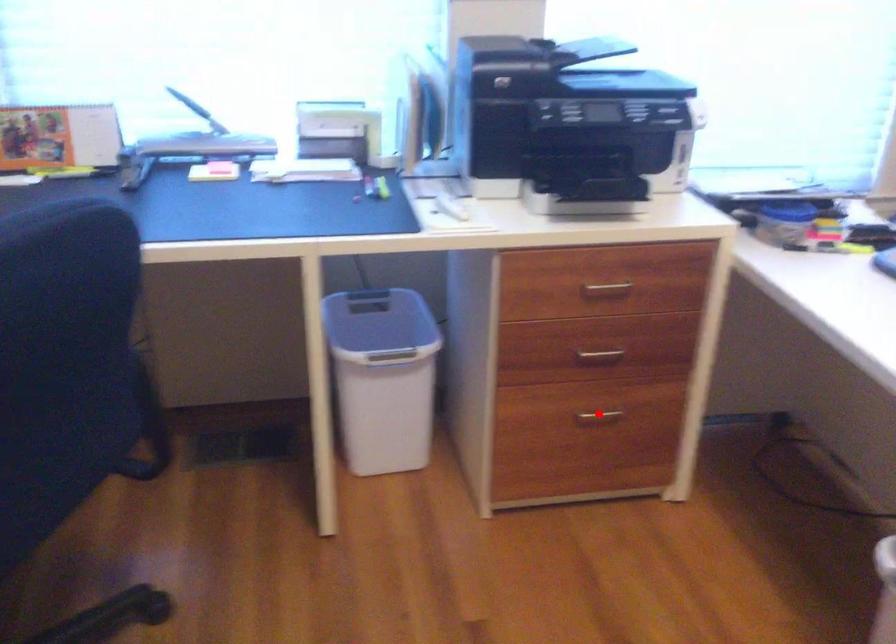
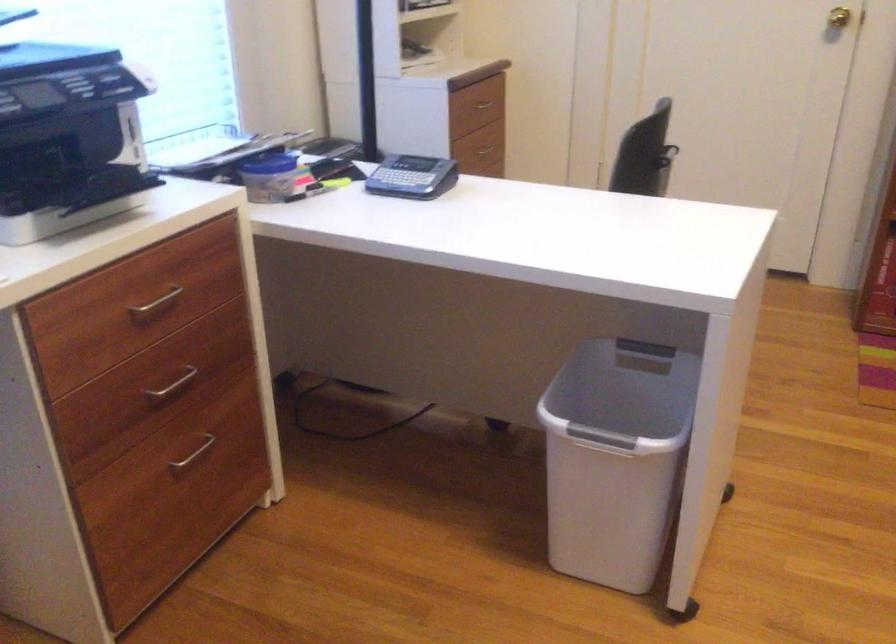
Question: I am providing you with two images of the same scene from different viewpoints. Image1 has a red point marked. In image2, the corresponding 3D location appears at what relative position? Reply with the corresponding letter.

Choices:
 (A) Closer
 (B) Farther

Answer: (A)